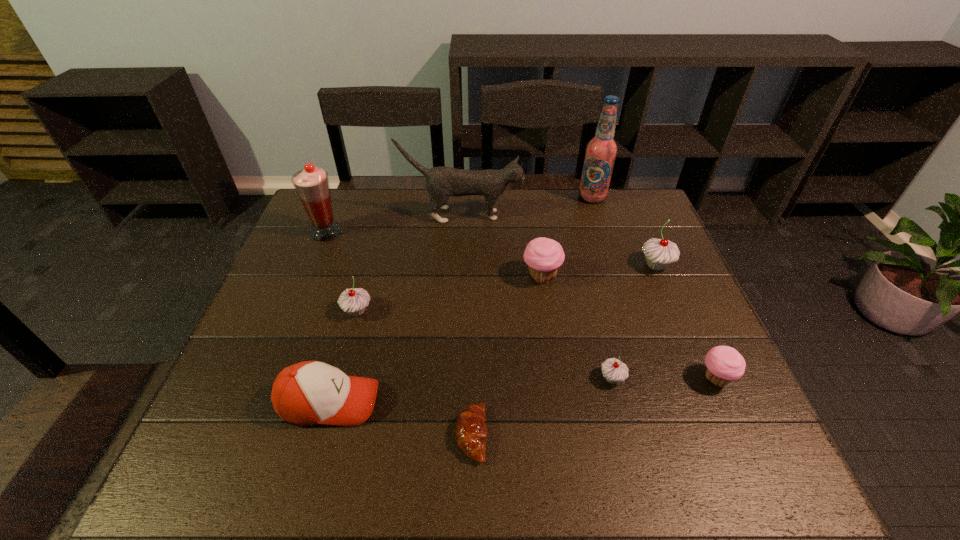
Locate an element on the screen. The image size is (960, 540). vacant space at the near right corner is located at coordinates (726, 456).

The height and width of the screenshot is (540, 960). I want to click on free space that is in between the leftmost gray cupcake and the rightmost gray cupcake, so [x=507, y=288].

Locate an element on the screen. The height and width of the screenshot is (540, 960). empty space that is in between the red smoothie and the third nearest cupcake is located at coordinates (342, 272).

What are the coordinates of `vacant point located between the shortest object and the farther pink cupcake` in the screenshot? It's located at (506, 355).

This screenshot has width=960, height=540. I want to click on free space that is in between the smaller pink cupcake and the rightmost gray cupcake, so click(685, 322).

At what (x,y) coordinates should I click in order to perform the action: click on free space between the orange baseball cap and the farther pink cupcake. Please return your answer as a coordinate pair (x, y). Looking at the image, I should click on (436, 339).

In order to click on vacant area between the smoothie and the nearer pink cupcake in this screenshot , I will do `click(521, 305)`.

Find the location of a particular element. vacant space that's between the biggest gray cupcake and the nearest gray cupcake is located at coordinates (634, 322).

You are a GUI agent. You are given a task and a screenshot of the screen. Output one action in this format:
    pyautogui.click(x=<x>, y=<y>)
    Task: Click on the vacant space that is in between the crescent roll and the farthest object
    The image size is (960, 540).
    Given the screenshot: What is the action you would take?
    pyautogui.click(x=532, y=316)

You are a GUI agent. You are given a task and a screenshot of the screen. Output one action in this format:
    pyautogui.click(x=<x>, y=<y>)
    Task: Click on the free space between the brown crescent roll and the red smoothie
    This screenshot has height=540, width=960.
    Given the screenshot: What is the action you would take?
    pyautogui.click(x=398, y=333)